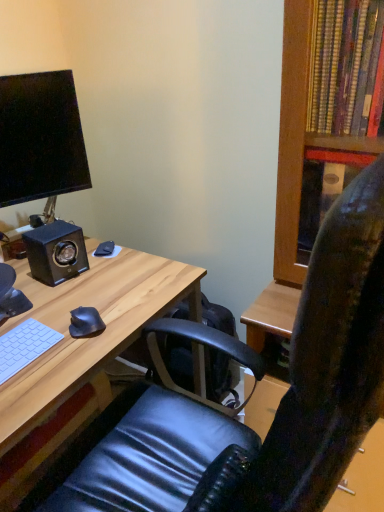
Question: From a real-world perspective, is light wood desk at center on black matte mouse at lower left, the 1th mouse when ordered from top to bottom?

Choices:
 (A) no
 (B) yes

Answer: (A)

Question: Can you confirm if light wood desk at center is positioned to the left of black matte mouse at lower left, the 1th mouse when ordered from top to bottom?

Choices:
 (A) no
 (B) yes

Answer: (B)

Question: Is light wood desk at center in front of black matte mouse at lower left, the second mouse when ordered from bottom to top?

Choices:
 (A) no
 (B) yes

Answer: (B)

Question: Can black matte mouse at lower left, the second mouse when ordered from bottom to top, be found inside light wood desk at center?

Choices:
 (A) yes
 (B) no

Answer: (B)

Question: Is light wood desk at center shorter than black matte mouse at lower left, which is the first mouse in back-to-front order?

Choices:
 (A) yes
 (B) no

Answer: (B)

Question: Is black matte speaker at left taller or shorter than black matte mouse at lower left, marked as the second mouse in a top-to-bottom arrangement?

Choices:
 (A) short
 (B) tall

Answer: (B)

Question: In terms of width, does black matte speaker at left look wider or thinner when compared to black matte mouse at lower left, marked as the second mouse in a top-to-bottom arrangement?

Choices:
 (A) wide
 (B) thin

Answer: (A)

Question: Considering their positions, is black matte speaker at left located in front of or behind black matte mouse at lower left, marked as the 1th mouse in a front-to-back arrangement?

Choices:
 (A) front
 (B) behind

Answer: (B)

Question: Considering the positions of point (62, 261) and point (97, 312), is point (62, 261) closer or farther from the camera than point (97, 312)?

Choices:
 (A) farther
 (B) closer

Answer: (A)

Question: In terms of width, does black matte speaker at left look wider or thinner when compared to black matte mouse at lower left, which is counted as the 2th mouse, starting from the front?

Choices:
 (A) thin
 (B) wide

Answer: (B)

Question: Relative to black matte mouse at lower left, the second mouse when ordered from bottom to top, is black matte speaker at left in front or behind?

Choices:
 (A) behind
 (B) front

Answer: (B)

Question: From the image's perspective, relative to black matte mouse at lower left, the 1th mouse when ordered from top to bottom, is black matte speaker at left above or below?

Choices:
 (A) above
 (B) below

Answer: (B)

Question: Is black matte speaker at left inside the boundaries of black matte mouse at lower left, which is the first mouse in back-to-front order, or outside?

Choices:
 (A) inside
 (B) outside

Answer: (B)

Question: Considering the relative positions of white matte keyboard at lower left and black matte speaker at left in the image provided, is white matte keyboard at lower left to the left or to the right of black matte speaker at left?

Choices:
 (A) right
 (B) left

Answer: (B)

Question: Is point (8, 371) positioned closer to the camera than point (66, 233)?

Choices:
 (A) farther
 (B) closer

Answer: (B)